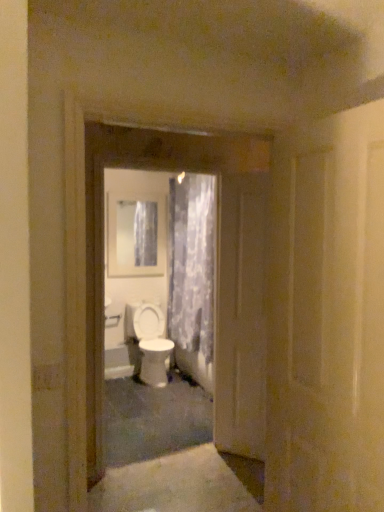
Question: Is white glossy door at center, which is the third door from back to front, not near white glossy door at center, which is the 2th door in front-to-back order?

Choices:
 (A) yes
 (B) no

Answer: (A)

Question: Is white glossy door at center, arranged as the second door when viewed from the back, inside white glossy door at center, placed as the first door when sorted from front to back?

Choices:
 (A) yes
 (B) no

Answer: (B)

Question: Is white glossy door at center, placed as the first door when sorted from front to back, further to the viewer compared to white glossy door at center, arranged as the second door when viewed from the back?

Choices:
 (A) yes
 (B) no

Answer: (B)

Question: Is white glossy door at center, which is the third door from back to front, facing away from white glossy door at center, arranged as the second door when viewed from the back?

Choices:
 (A) no
 (B) yes

Answer: (A)

Question: Is white glossy door at center, placed as the first door when sorted from front to back, with white glossy door at center, which is the 2th door in front-to-back order?

Choices:
 (A) no
 (B) yes

Answer: (A)

Question: Does point (142, 201) appear closer or farther from the camera than point (152, 381)?

Choices:
 (A) closer
 (B) farther

Answer: (B)

Question: From the image's perspective, is white glossy medicine cabinet at upper center above or below white glossy toilet at center?

Choices:
 (A) below
 (B) above

Answer: (B)

Question: Would you say white glossy medicine cabinet at upper center is inside or outside white glossy toilet at center?

Choices:
 (A) inside
 (B) outside

Answer: (B)

Question: From their relative heights in the image, would you say white glossy medicine cabinet at upper center is taller or shorter than white glossy toilet at center?

Choices:
 (A) short
 (B) tall

Answer: (B)

Question: Is white glossy door at center, placed as the first door when sorted from front to back, wider or thinner than white glossy toilet at center?

Choices:
 (A) thin
 (B) wide

Answer: (A)

Question: In terms of height, does white glossy door at center, which is the third door from back to front, look taller or shorter compared to white glossy toilet at center?

Choices:
 (A) tall
 (B) short

Answer: (A)

Question: From the image's perspective, is white glossy door at center, placed as the first door when sorted from front to back, located above or below white glossy toilet at center?

Choices:
 (A) below
 (B) above

Answer: (B)

Question: Is point (365, 252) positioned closer to the camera than point (160, 355)?

Choices:
 (A) closer
 (B) farther

Answer: (A)

Question: Based on their sizes in the image, would you say white glossy door at center, which is the 2th door in front-to-back order, is bigger or smaller than white glossy door at center, which is the third door from back to front?

Choices:
 (A) small
 (B) big

Answer: (B)

Question: Considering the positions of white glossy door at center, which is the 2th door in front-to-back order, and white glossy door at center, which is the third door from back to front, in the image, is white glossy door at center, which is the 2th door in front-to-back order, taller or shorter than white glossy door at center, which is the third door from back to front,?

Choices:
 (A) short
 (B) tall

Answer: (B)